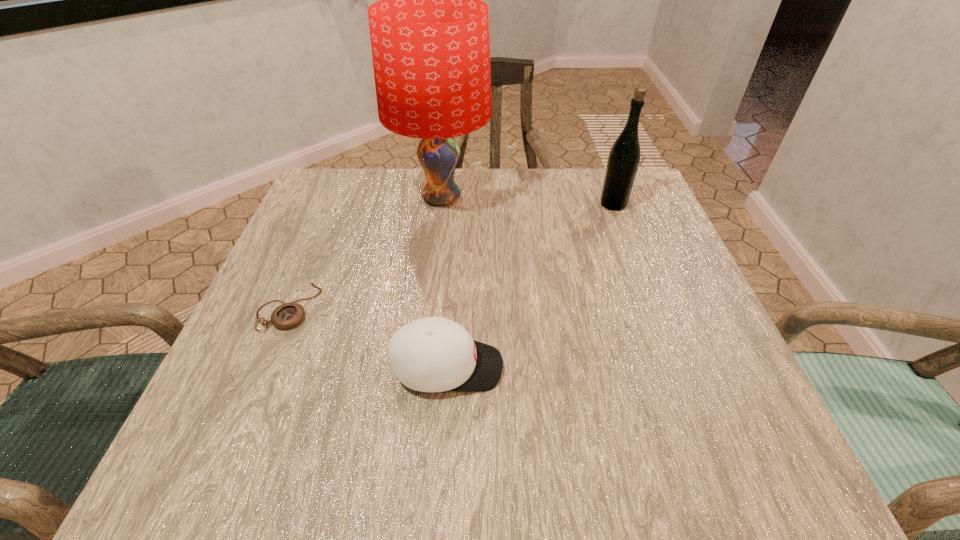
Where is `vacant space situated 0.060m on the front of the pocket watch`? vacant space situated 0.060m on the front of the pocket watch is located at coordinates (265, 362).

You are a GUI agent. You are given a task and a screenshot of the screen. Output one action in this format:
    pyautogui.click(x=<x>, y=<y>)
    Task: Click on the lampshade that is at the far edge
    
    Given the screenshot: What is the action you would take?
    pyautogui.click(x=429, y=33)

This screenshot has height=540, width=960. I want to click on beer bottle situated at the far edge, so click(x=624, y=157).

This screenshot has width=960, height=540. In order to click on object that is at the left edge in this screenshot , I will do `click(288, 315)`.

Image resolution: width=960 pixels, height=540 pixels. In order to click on object that is at the right edge in this screenshot , I will do `click(624, 157)`.

Locate an element on the screen. The height and width of the screenshot is (540, 960). object that is at the far right corner is located at coordinates [624, 157].

The width and height of the screenshot is (960, 540). I want to click on free space at the far edge of the desktop, so click(x=543, y=199).

Where is `free space at the left edge`? The image size is (960, 540). free space at the left edge is located at coordinates (331, 246).

Locate an element on the screen. The height and width of the screenshot is (540, 960). vacant space at the right edge is located at coordinates (671, 258).

In the image, there is a desktop. Where is `free space at the far left corner`? Image resolution: width=960 pixels, height=540 pixels. free space at the far left corner is located at coordinates (375, 204).